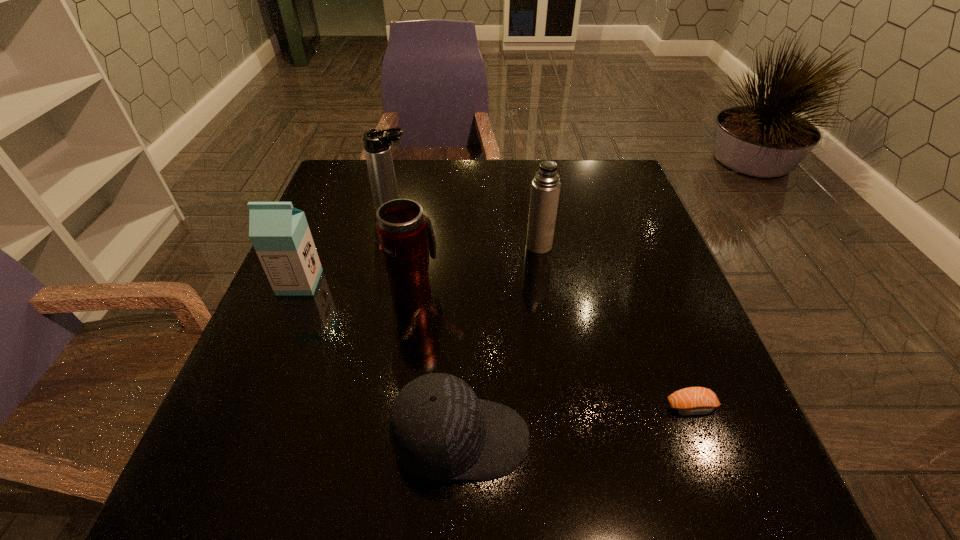
Identify the location of the farthest object. Image resolution: width=960 pixels, height=540 pixels. (377, 148).

The width and height of the screenshot is (960, 540). I want to click on the nearest thermos bottle, so click(406, 236).

Identify the location of the fifth nearest object. (545, 189).

This screenshot has height=540, width=960. Identify the location of the rightmost thermos bottle. (545, 189).

Where is `milk carton`? milk carton is located at coordinates (279, 232).

Image resolution: width=960 pixels, height=540 pixels. I want to click on the second shortest object, so click(439, 430).

I want to click on the shortest object, so click(x=689, y=401).

Identify the location of the rightmost object. (689, 401).

This screenshot has height=540, width=960. Identify the location of vacant space located 0.060m on the handle side of the farthest thermos bottle. (435, 210).

At what (x,y) coordinates should I click in order to perform the action: click on vacant area situated 0.320m on the side with the handle of the nearest thermos bottle. Please return your answer as a coordinate pair (x, y). Looking at the image, I should click on (429, 197).